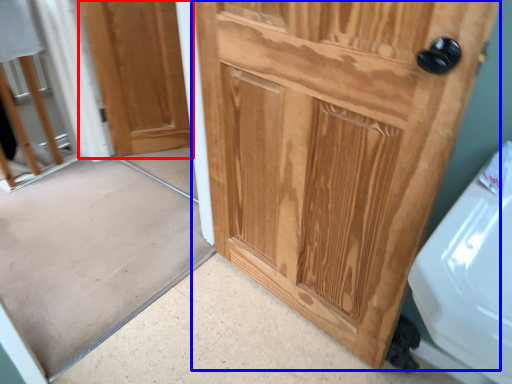
Question: Which object is closer to the camera taking this photo, door (highlighted by a red box) or door (highlighted by a blue box)?

Choices:
 (A) door
 (B) door

Answer: (B)